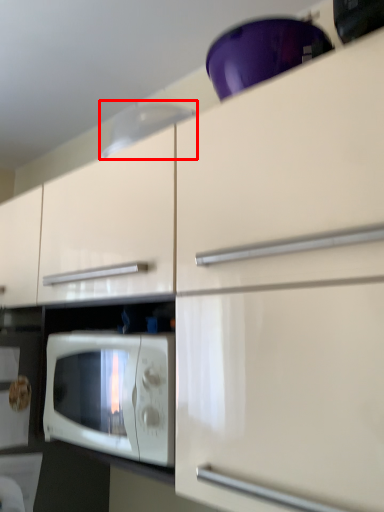
Question: From the image, what is the correct spatial relationship of exhaust hood (annotated by the red box) in relation to microwave oven?

Choices:
 (A) left
 (B) right

Answer: (B)